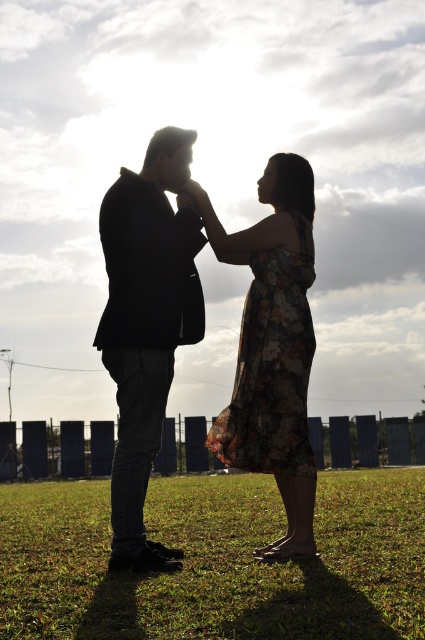
Question: Is green grass at center further to the viewer compared to floral-patterned fabric dress at center?

Choices:
 (A) no
 (B) yes

Answer: (A)

Question: Which object appears farthest from the camera in this image?

Choices:
 (A) green grass at center
 (B) floral-patterned fabric dress at center
 (C) black matte suit at center

Answer: (B)

Question: Is green grass at center in front of floral-patterned fabric dress at center?

Choices:
 (A) yes
 (B) no

Answer: (A)

Question: Which point appears farthest from the camera in this image?

Choices:
 (A) (2, 492)
 (B) (150, 248)
 (C) (274, 260)

Answer: (A)

Question: Among these points, which one is farthest from the camera?

Choices:
 (A) (132, 416)
 (B) (297, 440)
 (C) (102, 566)

Answer: (B)

Question: Is green grass at center to the right of black matte suit at center from the viewer's perspective?

Choices:
 (A) yes
 (B) no

Answer: (A)